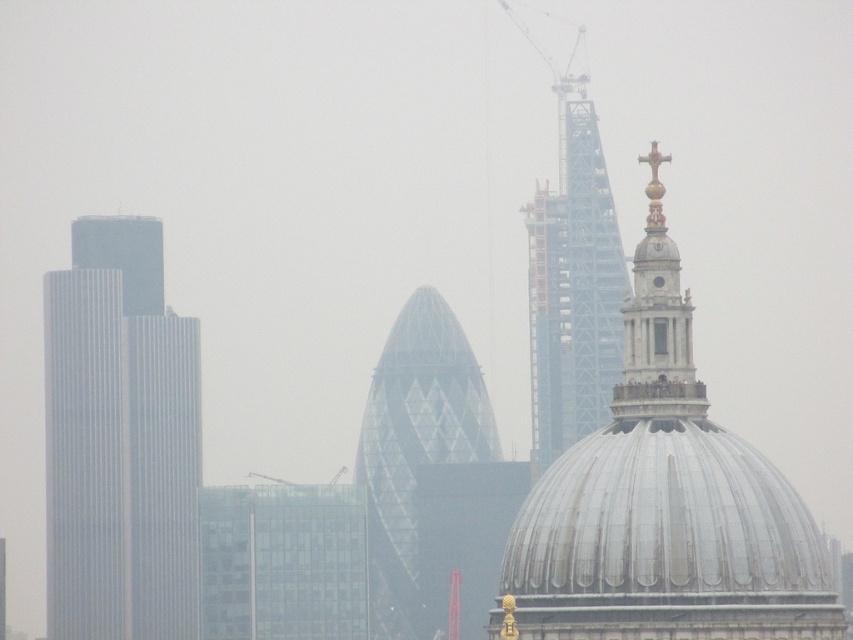
Is smooth glass skyscraper at left below gold polished cross at upper center?

Indeed, smooth glass skyscraper at left is positioned under gold polished cross at upper center.

You are a GUI agent. You are given a task and a screenshot of the screen. Output one action in this format:
    pyautogui.click(x=<x>, y=<y>)
    Task: Click on the smooth glass skyscraper at left
    The width and height of the screenshot is (853, 640).
    Given the screenshot: What is the action you would take?
    pyautogui.click(x=119, y=440)

Which is in front, point (107, 332) or point (659, 392)?

Point (659, 392)

What are the coordinates of `smooth glass skyscraper at left` in the screenshot? It's located at (119, 440).

Which of these two, smooth glass skyscraper at left or glassy triangular building at center, stands taller?

With more height is smooth glass skyscraper at left.

At what (x,y) coordinates should I click in order to perform the action: click on smooth glass skyscraper at left. Please return your answer as a coordinate pair (x, y). Looking at the image, I should click on (119, 440).

Where is `smooth glass skyscraper at left`? smooth glass skyscraper at left is located at coordinates (119, 440).

Does shiny silver dome at center come in front of glassy steel tower at upper center?

Yes.

Who is more forward, (611, 618) or (552, 193)?

Point (611, 618) is more forward.

The height and width of the screenshot is (640, 853). Find the location of `shiny silver dome at center`. shiny silver dome at center is located at coordinates (663, 504).